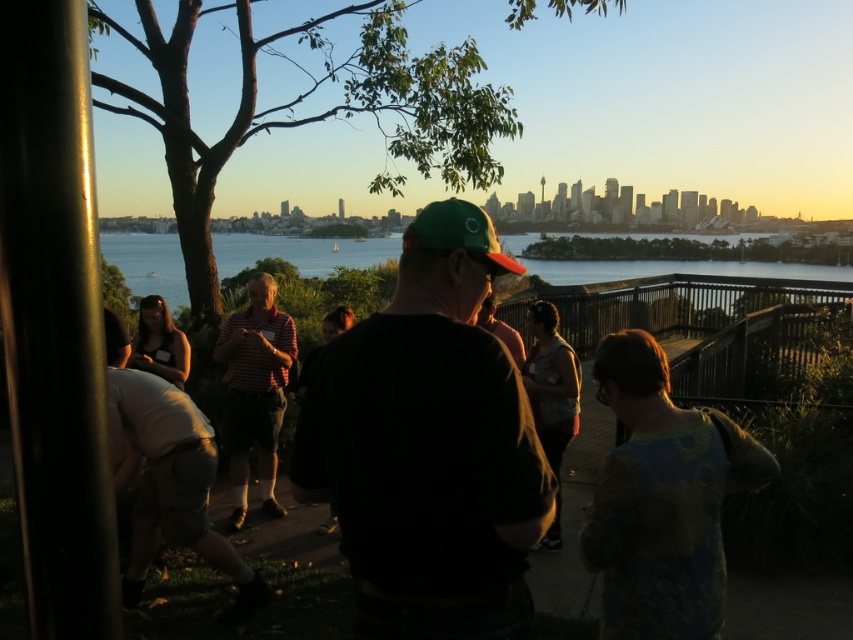
Can you confirm if blue water at center is positioned to the right of striped cotton shirt at center?

Indeed, blue water at center is positioned on the right side of striped cotton shirt at center.

Who is taller, blue water at center or striped cotton shirt at center?

blue water at center

Is point (793, 268) positioned in front of point (260, 483)?

That is False.

The image size is (853, 640). In order to click on blue water at center in this screenshot , I will do (300, 252).

Does blue water at center have a larger size compared to green fabric baseball cap at center?

Yes.

Does blue water at center have a lesser width compared to green fabric baseball cap at center?

No.

Does point (519, 241) come farther from viewer compared to point (427, 234)?

Yes, it is.

Identify the location of blue water at center. The height and width of the screenshot is (640, 853). (300, 252).

Is green fabric cap at center shorter than blue water at center?

Correct, green fabric cap at center is not as tall as blue water at center.

Which is below, green fabric cap at center or blue water at center?

green fabric cap at center is lower down.

Is point (402, 252) closer to camera compared to point (173, 285)?

Yes.

This screenshot has height=640, width=853. In order to click on green fabric cap at center in this screenshot , I will do `click(428, 445)`.